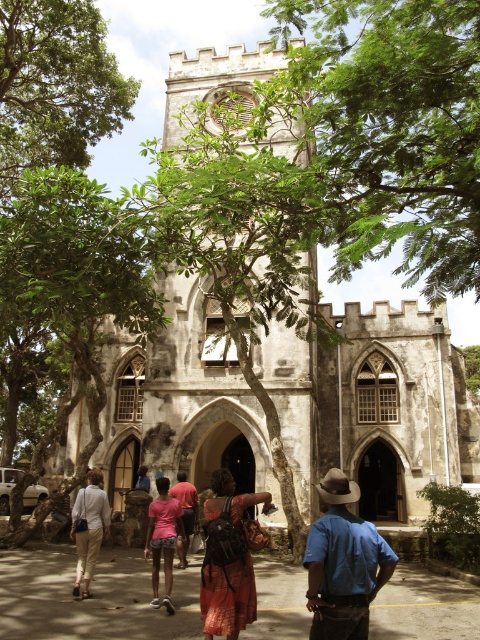
Is the position of white stone tower at center more distant than that of printed cotton dress at center?

That is True.

Can you confirm if white stone tower at center is positioned to the left of printed cotton dress at center?

Indeed, white stone tower at center is positioned on the left side of printed cotton dress at center.

Between point (195, 244) and point (245, 493), which one is positioned in front?

Point (245, 493) is in front.

Find the location of a particular element. The width and height of the screenshot is (480, 640). white stone tower at center is located at coordinates (237, 220).

Can you confirm if green leafy tree at center is positioned to the right of white stone tower at center?

Yes, green leafy tree at center is to the right of white stone tower at center.

Can you confirm if green leafy tree at center is wider than white stone tower at center?

No, green leafy tree at center is not wider than white stone tower at center.

Who is more distant from viewer, (468,29) or (232,257)?

The point (232,257) is more distant.

Locate an element on the screen. Image resolution: width=480 pixels, height=640 pixels. green leafy tree at center is located at coordinates (395, 131).

Can you confirm if green leafy tree at upper left is positioned below blue denim shirt at center?

No.

Describe the element at coordinates (56, 84) in the screenshot. Image resolution: width=480 pixels, height=640 pixels. I see `green leafy tree at upper left` at that location.

Which is behind, point (104, 45) or point (347, 570)?

The point (104, 45) is more distant.

Locate an element on the screen. green leafy tree at upper left is located at coordinates (56, 84).